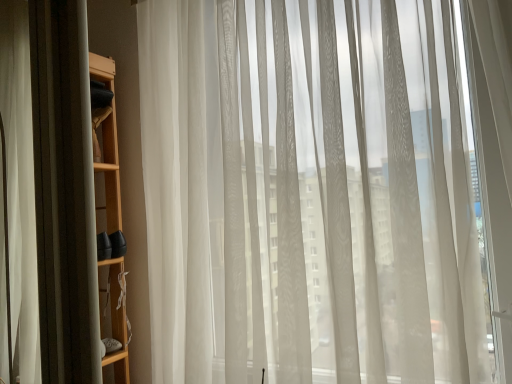
What do you see at coordinates (309, 193) in the screenshot?
I see `sheer white curtain at left` at bounding box center [309, 193].

What is the approximate width of sheer white curtain at left?

It is 10.05 inches.

In order to face sheer white curtain at left, should I rotate leftwards or rightwards?

Turn right by 2.067 degrees to look at sheer white curtain at left.

Identify the location of sheer white curtain at left. The width and height of the screenshot is (512, 384). (309, 193).

You are a GUI agent. You are given a task and a screenshot of the screen. Output one action in this format:
    pyautogui.click(x=<x>, y=<y>)
    Task: Click on the sheer white curtain at left
    
    Given the screenshot: What is the action you would take?
    pyautogui.click(x=309, y=193)